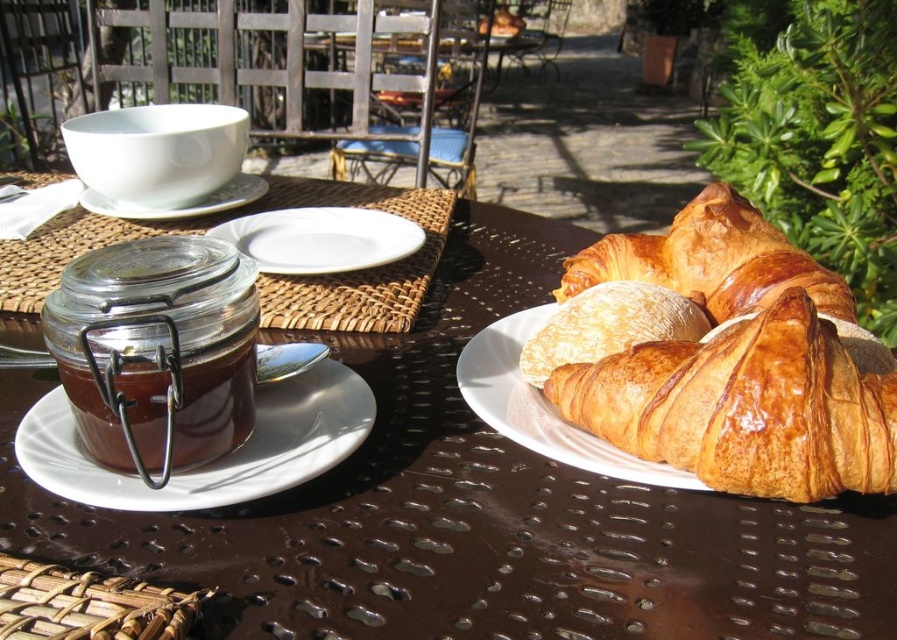
In the scene shown: You are setting up a breakfast table and want to place a decorative vase between the white ceramic plate at center and the golden brown flaky croissant at center. Based on their current positions, where should you position the vase to ensure it is exactly between them?

Since the white ceramic plate at center is to the left of the golden brown flaky croissant at center, you should place the vase to the right of the white ceramic plate at center and to the left of the golden brown flaky croissant at center, positioning it exactly in the middle between the two items.

From the picture: You are setting up a picnic and need to place the golden brown flaky croissant at center and the white ceramic saucer at upper left on a small table. Based on their sizes, which item will require more space on the table?

The white ceramic saucer at upper left requires more space on the table because the golden brown flaky croissant at center has a lesser width compared to it.